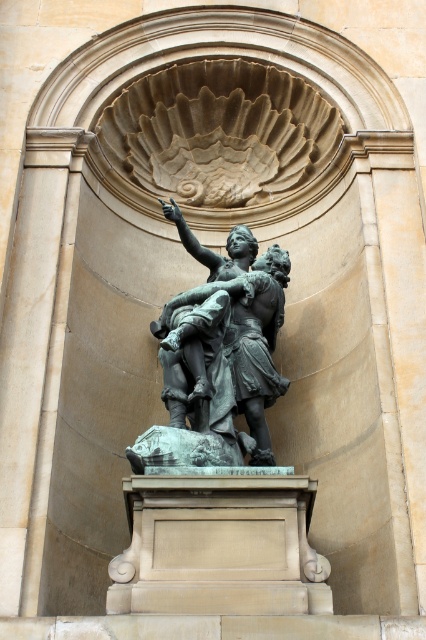
Does bronze statue at center appear on the left side of smooth beige stone pillar at center?

In fact, bronze statue at center is to the right of smooth beige stone pillar at center.

Who is taller, bronze statue at center or smooth beige stone pillar at center?

smooth beige stone pillar at center is taller.

Is point (219, 305) behind point (40, 467)?

Yes, it is behind point (40, 467).

Where is `bronze statue at center`? The width and height of the screenshot is (426, 640). bronze statue at center is located at coordinates (218, 355).